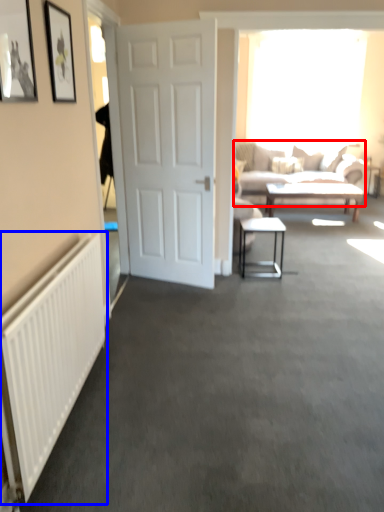
Question: Which of the following is the closest to the observer, studio couch (highlighted by a red box) or radiator (highlighted by a blue box)?

Choices:
 (A) studio couch
 (B) radiator

Answer: (B)